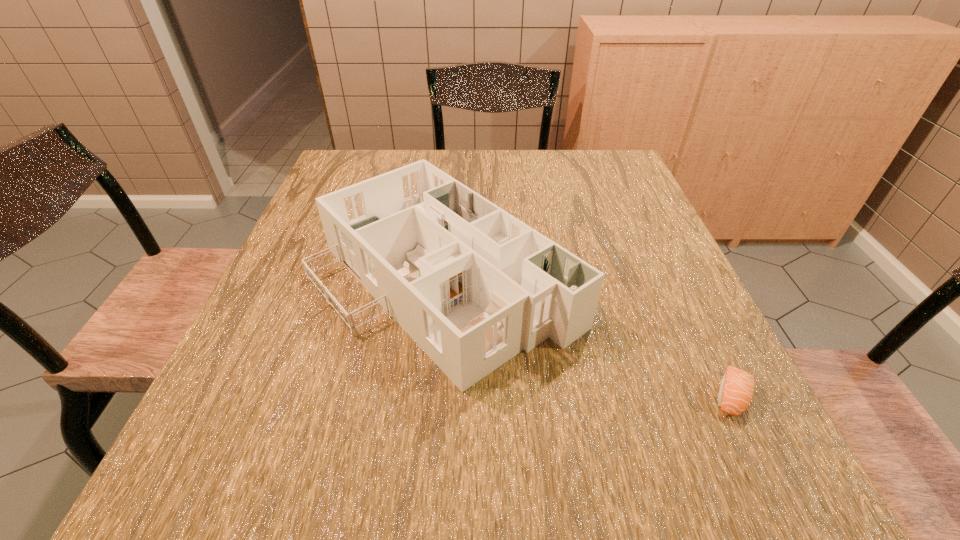
In the image, there is a desktop. Identify the location of vacant space at the right edge. (637, 207).

Image resolution: width=960 pixels, height=540 pixels. In the image, there is a desktop. Find the location of `vacant space at the far left corner`. vacant space at the far left corner is located at coordinates (331, 183).

The image size is (960, 540). What are the coordinates of `vacant space at the far right corner of the desktop` in the screenshot? It's located at (581, 168).

The width and height of the screenshot is (960, 540). I want to click on blank area in the image that satisfies the following two spatial constraints: 1. on the front side of the left object; 2. on the left side of the sushi, so click(434, 396).

Where is `free spot that satisfies the following two spatial constraints: 1. on the front side of the taller object; 2. on the left side of the shorter object`? This screenshot has width=960, height=540. free spot that satisfies the following two spatial constraints: 1. on the front side of the taller object; 2. on the left side of the shorter object is located at coordinates (434, 396).

The image size is (960, 540). What are the coordinates of `free location that satisfies the following two spatial constraints: 1. on the front side of the sushi; 2. on the right side of the dollhouse` in the screenshot? It's located at (434, 396).

Locate an element on the screen. The image size is (960, 540). free location that satisfies the following two spatial constraints: 1. on the front side of the left object; 2. on the left side of the right object is located at coordinates (434, 396).